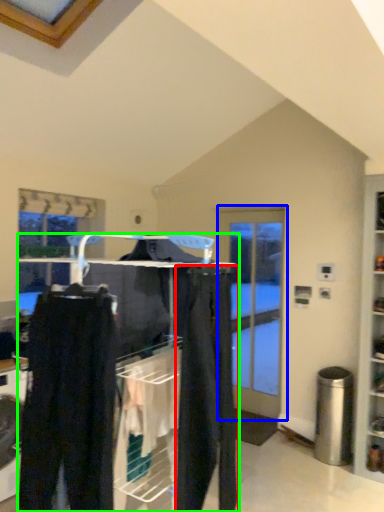
Question: Estimate the real-world distances between objects in this image. Which object is farther from clothing (highlighted by a red box), door (highlighted by a blue box) or closet (highlighted by a green box)?

Choices:
 (A) door
 (B) closet

Answer: (A)